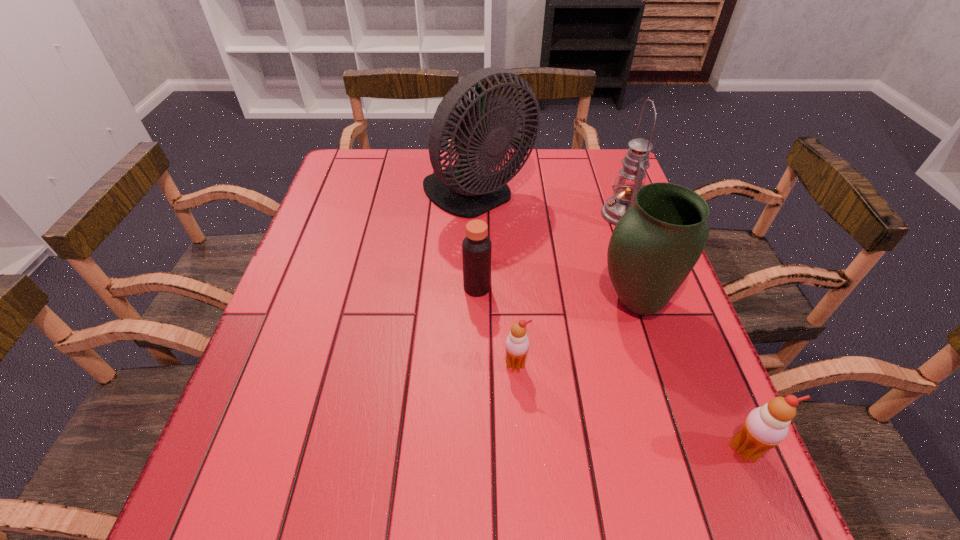
Locate an element on the screen. The image size is (960, 540). free region at the left edge of the desktop is located at coordinates (300, 260).

The width and height of the screenshot is (960, 540). I want to click on free location at the right edge, so click(x=633, y=357).

This screenshot has width=960, height=540. In order to click on free space at the far left corner in this screenshot , I will do `click(352, 170)`.

In the image, there is a desktop. In order to click on vacant space at the far right corner in this screenshot , I will do `click(600, 160)`.

The image size is (960, 540). Find the location of `empty location between the fan and the vase`. empty location between the fan and the vase is located at coordinates (556, 249).

Locate an element on the screen. free space that is in between the oil lamp and the nearest object is located at coordinates (683, 332).

Image resolution: width=960 pixels, height=540 pixels. I want to click on free space between the nearest object and the oil lamp, so click(683, 332).

Identify the location of vacant space that's between the nearer icecream and the vinegar. (611, 369).

What are the coordinates of `empty location between the fan and the shortest object` in the screenshot? It's located at (496, 280).

The height and width of the screenshot is (540, 960). In order to click on free point between the oil lamp and the vinegar in this screenshot , I will do `click(549, 251)`.